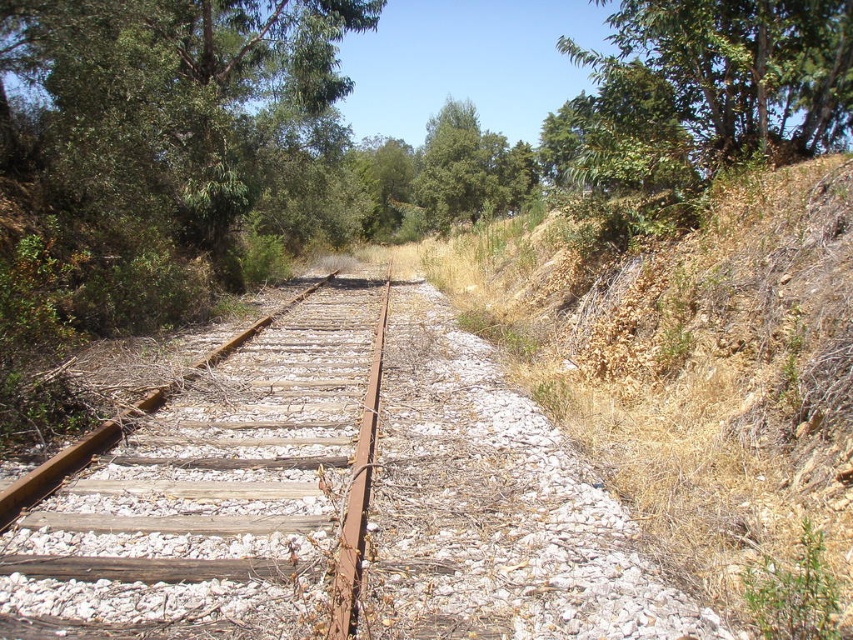
Question: Which point appears farthest from the camera in this image?

Choices:
 (A) (265, 394)
 (B) (651, 136)
 (C) (656, 468)

Answer: (B)

Question: Does dry grass at right come in front of green leafy tree at upper right?

Choices:
 (A) yes
 (B) no

Answer: (A)

Question: Is dry grass at right thinner than rusty metal train track at center?

Choices:
 (A) yes
 (B) no

Answer: (B)

Question: Among these points, which one is farthest from the camera?

Choices:
 (A) (819, 76)
 (B) (245, 609)
 (C) (708, 436)

Answer: (A)

Question: Considering the real-world distances, which object is farthest from the rusty metal train track at center?

Choices:
 (A) green leafy tree at upper right
 (B) dry grass at right

Answer: (A)

Question: Is rusty metal train track at center smaller than green leafy tree at upper right?

Choices:
 (A) no
 (B) yes

Answer: (B)